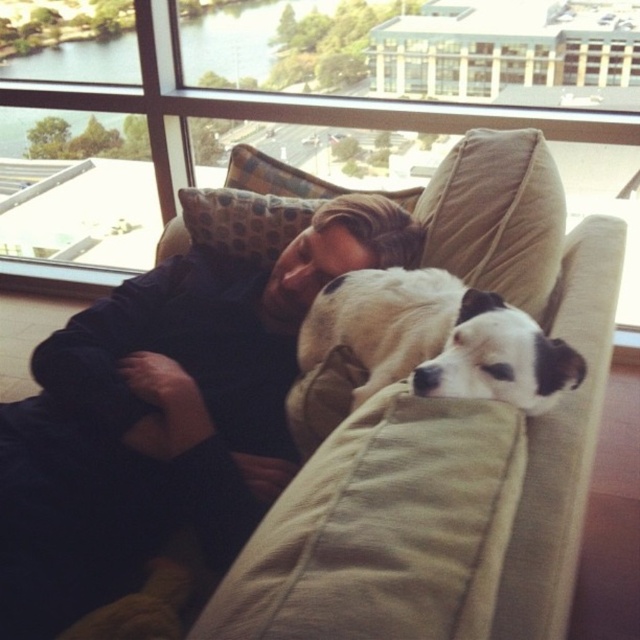
You are trying to rearrange the furniture in the living room. The beige fabric couch at center and the transparent glass window at upper center are in your way. Which object takes up more space in the room?

The transparent glass window at upper center takes up more space in the room than the beige fabric couch at center because the beige fabric couch at center occupies less space than transparent glass window at upper center.

You are a visitor in this room and want to sit on the beige fabric couch at center without blocking the view through the transparent glass window at upper center. Where should you sit in relation to the window?

The beige fabric couch at center is positioned on the right side of the transparent glass window at upper center, so to sit without blocking the view, you should sit on the left side of the couch relative to the window.